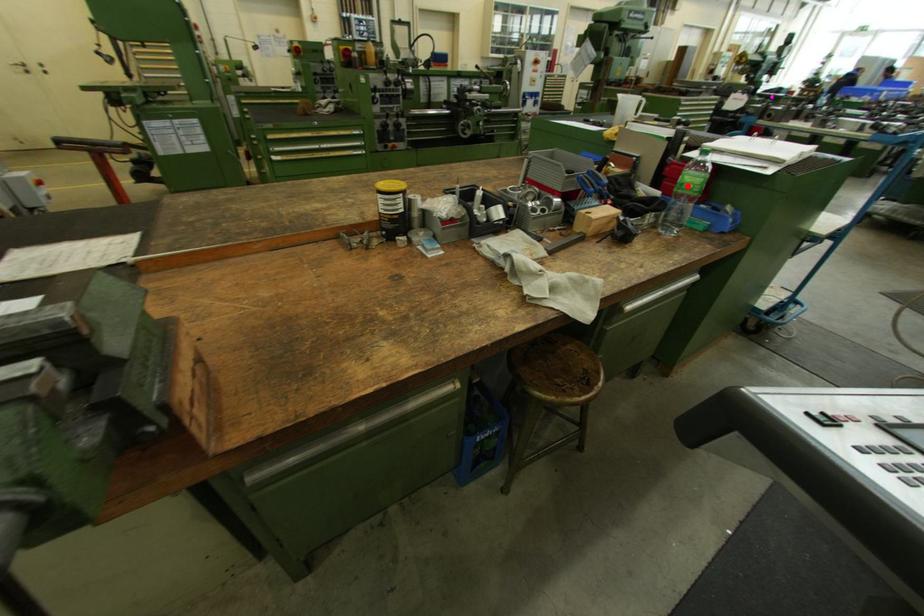
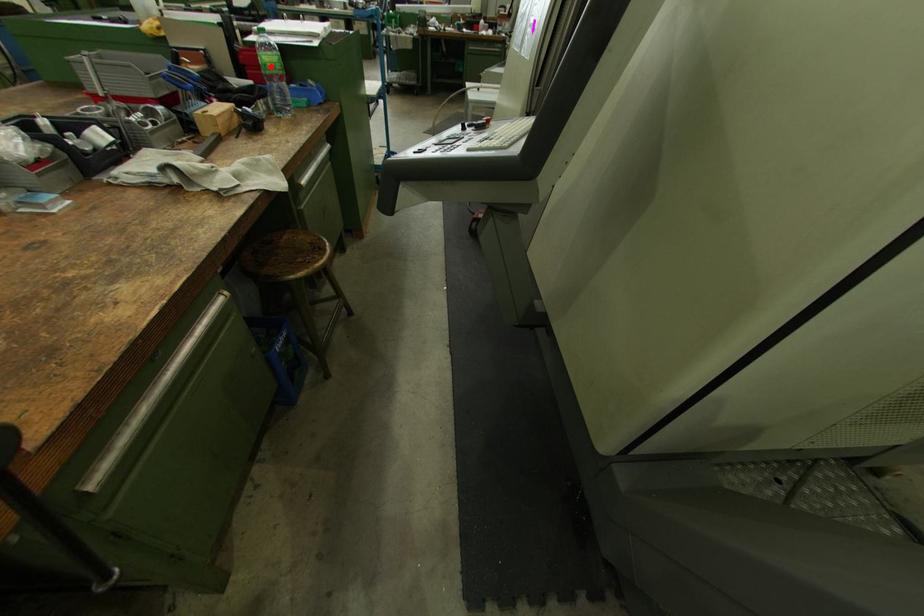
I am providing you with two images of the same scene from different viewpoints. A red point is marked on the first image and another point is marked on the second image. Do the highlighted points in image1 and image2 indicate the same real-world spot?

Yes